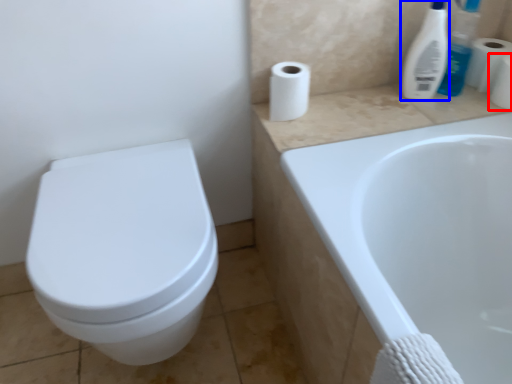
Question: Among these objects, which one is nearest to the camera, toilet paper (highlighted by a red box) or cleaning product (highlighted by a blue box)?

Choices:
 (A) toilet paper
 (B) cleaning product

Answer: (B)